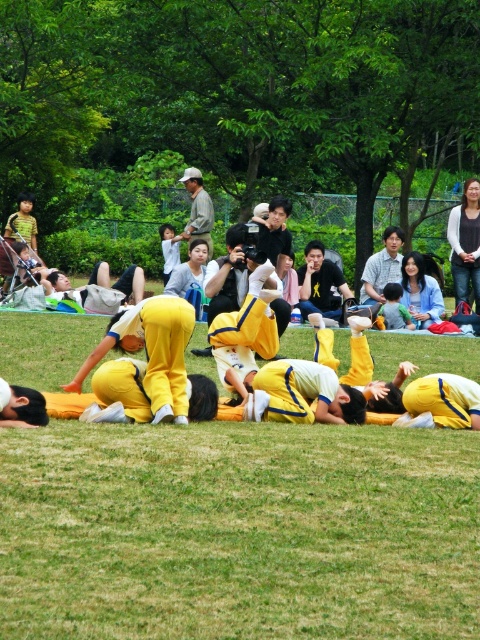
You are a photographer standing in the park. You see the green grass at center and the black matte shirt at center. Which object is positioned to the right?

The black matte shirt at center is positioned to the right of the green grass at center.

You are a photographer standing at the edge of the park and see the green grass at center and the light brown fabric shirt at upper center. Which object is positioned to the right side of the other?

The green grass at center is to the right of the light brown fabric shirt at upper center.